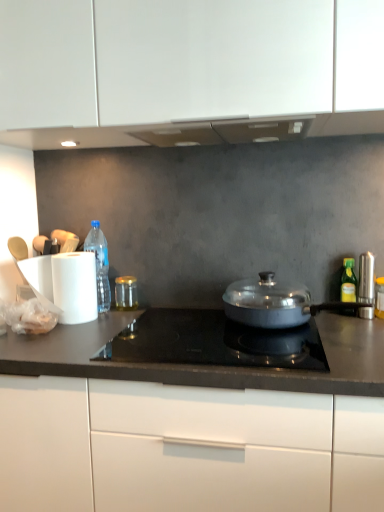
Question: Does white matte cabinet at center have a smaller size compared to translucent plastic bottle at left, the first bottle from the back?

Choices:
 (A) yes
 (B) no

Answer: (B)

Question: From the image's perspective, is white matte cabinet at center under translucent plastic bottle at left, the first bottle from the back?

Choices:
 (A) yes
 (B) no

Answer: (A)

Question: Considering the relative sizes of white matte cabinet at center and translucent plastic bottle at left, marked as the 2th bottle in a front-to-back arrangement, in the image provided, is white matte cabinet at center bigger than translucent plastic bottle at left, marked as the 2th bottle in a front-to-back arrangement,?

Choices:
 (A) no
 (B) yes

Answer: (B)

Question: Does white matte cabinet at center have a lesser height compared to translucent plastic bottle at left, marked as the 2th bottle in a front-to-back arrangement?

Choices:
 (A) yes
 (B) no

Answer: (B)

Question: From the image's perspective, would you say white matte cabinet at center is positioned over translucent plastic bottle at left, which ranks as the first bottle in left-to-right order?

Choices:
 (A) no
 (B) yes

Answer: (A)

Question: Would you say satin black cooktop at center is to the left or to the right of translucent plastic bottle at left, marked as the 2th bottle in a front-to-back arrangement, in the picture?

Choices:
 (A) left
 (B) right

Answer: (B)

Question: Is point (162, 309) closer or farther from the camera than point (107, 268)?

Choices:
 (A) closer
 (B) farther

Answer: (A)

Question: In the image, is satin black cooktop at center positioned in front of or behind translucent plastic bottle at left, the first bottle from the back?

Choices:
 (A) behind
 (B) front

Answer: (B)

Question: Is satin black cooktop at center wider or thinner than translucent plastic bottle at left, which is counted as the second bottle, starting from the right?

Choices:
 (A) thin
 (B) wide

Answer: (B)

Question: From the image's perspective, relative to white matte cabinet at center, is translucent plastic bottle at left, which ranks as the first bottle in left-to-right order, above or below?

Choices:
 (A) above
 (B) below

Answer: (A)

Question: Visually, is translucent plastic bottle at left, which ranks as the first bottle in left-to-right order, positioned to the left or to the right of white matte cabinet at center?

Choices:
 (A) left
 (B) right

Answer: (A)

Question: Is translucent plastic bottle at left, which is counted as the second bottle, starting from the right, bigger or smaller than white matte cabinet at center?

Choices:
 (A) big
 (B) small

Answer: (B)

Question: Considering the positions of translucent plastic bottle at left, the first bottle from the back, and white matte cabinet at center in the image, is translucent plastic bottle at left, the first bottle from the back, wider or thinner than white matte cabinet at center?

Choices:
 (A) wide
 (B) thin

Answer: (B)

Question: Considering the positions of translucent plastic bottle at left, the first bottle from the back, and yellow-green glass bottle at right, the first bottle positioned from the right, in the image, is translucent plastic bottle at left, the first bottle from the back, taller or shorter than yellow-green glass bottle at right, the first bottle positioned from the right,?

Choices:
 (A) tall
 (B) short

Answer: (A)

Question: Would you say translucent plastic bottle at left, marked as the 2th bottle in a front-to-back arrangement, is inside or outside yellow-green glass bottle at right, the first bottle positioned from the right?

Choices:
 (A) inside
 (B) outside

Answer: (B)